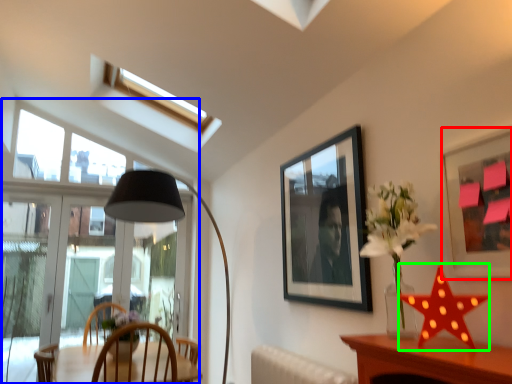
Question: Based on their relative distances, which object is nearer to picture frame (highlighted by a red box)? Choose from window (highlighted by a blue box) and star (highlighted by a green box).

Choices:
 (A) window
 (B) star

Answer: (B)